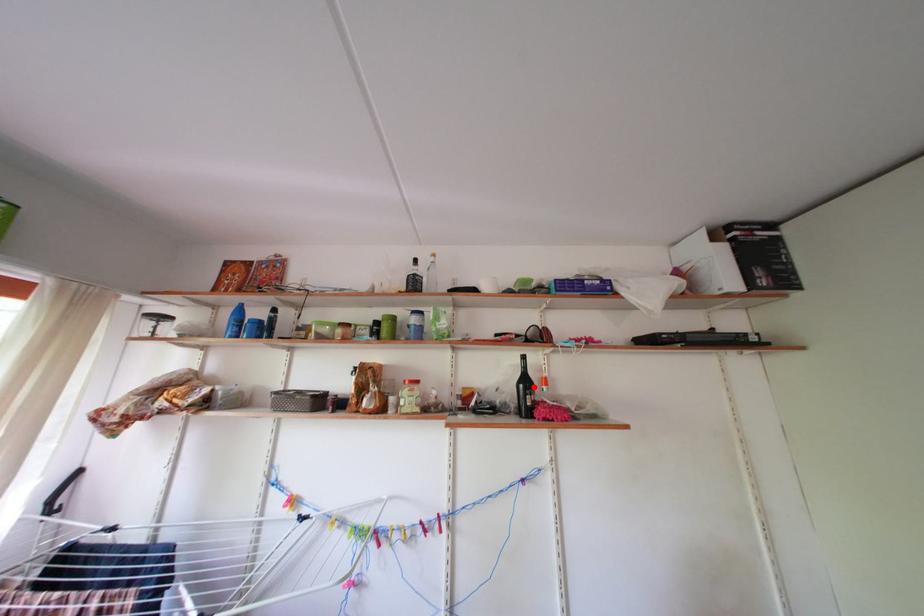
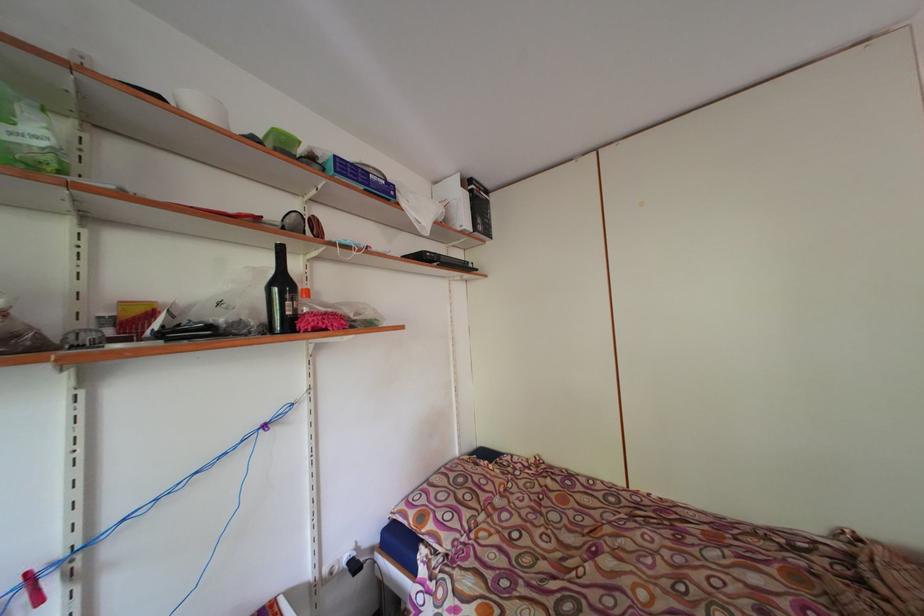
In the second image, find the point that corresponds to the highlighted location in the first image.

(290, 289)